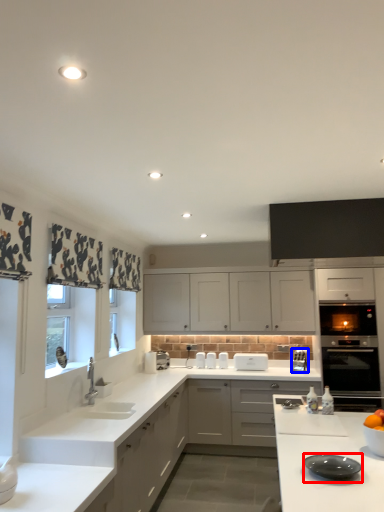
Question: Which object appears closest to the camera in this image, kitchen appliance (highlighted by a red box) or appliance (highlighted by a blue box)?

Choices:
 (A) kitchen appliance
 (B) appliance

Answer: (A)